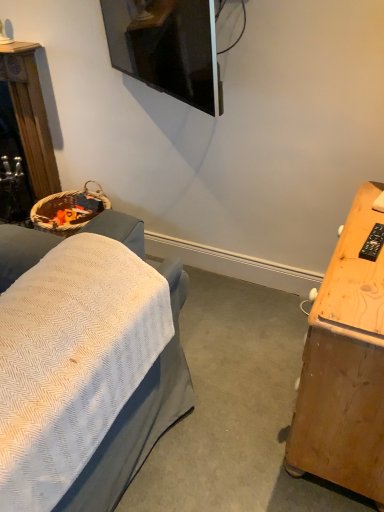
In order to click on woven basket at left in this screenshot , I will do `click(30, 115)`.

This screenshot has width=384, height=512. What do you see at coordinates (30, 115) in the screenshot?
I see `woven basket at left` at bounding box center [30, 115].

What do you see at coordinates (346, 362) in the screenshot? Image resolution: width=384 pixels, height=512 pixels. I see `light brown wood desk at right` at bounding box center [346, 362].

Consider the image. In order to face light brown wood desk at right, should I rotate leftwards or rightwards?

Turn right approximately 22.062 degrees to face it.

Find the location of a particular element. light brown wood desk at right is located at coordinates (346, 362).

Measure the distance between light brown wood desk at right and camera.

light brown wood desk at right is 38.52 inches from camera.

Locate an element on the screen. woven basket at left is located at coordinates (30, 115).

Is light brown wood desk at right to the left of woven basket at left from the viewer's perspective?

In fact, light brown wood desk at right is to the right of woven basket at left.

Does light brown wood desk at right lie behind woven basket at left?

No, the depth of light brown wood desk at right is less than that of woven basket at left.

Is point (303, 472) positioned before point (32, 104)?

Yes, it is.

From the image's perspective, between light brown wood desk at right and woven basket at left, who is located below?

light brown wood desk at right.

From a real-world perspective, is light brown wood desk at right physically above woven basket at left?

No, from a real-world perspective, light brown wood desk at right is not over woven basket at left

Considering the sizes of objects light brown wood desk at right and woven basket at left in the image provided, who is thinner, light brown wood desk at right or woven basket at left?

With smaller width is woven basket at left.

Between light brown wood desk at right and woven basket at left, which one has more height?

woven basket at left.

Considering the sizes of objects light brown wood desk at right and woven basket at left in the image provided, who is bigger, light brown wood desk at right or woven basket at left?

With larger size is light brown wood desk at right.

Is light brown wood desk at right not inside woven basket at left?

light brown wood desk at right is positioned outside woven basket at left.

Is the surface of light brown wood desk at right in direct contact with woven basket at left?

No, light brown wood desk at right is not with woven basket at left.

Is light brown wood desk at right facing towards woven basket at left?

Yes, light brown wood desk at right is aimed at woven basket at left.

How different are the orientations of light brown wood desk at right and woven basket at left in degrees?

The facing directions of light brown wood desk at right and woven basket at left are 90 degrees apart.

Where is `furniture that appears above the light brown wood desk at right (from a real-world perspective)`? The image size is (384, 512). furniture that appears above the light brown wood desk at right (from a real-world perspective) is located at coordinates (30, 115).

Does woven basket at left appear on the left side of light brown wood desk at right?

Yes, woven basket at left is to the left of light brown wood desk at right.

Is the depth of woven basket at left less than that of light brown wood desk at right?

No, it is not.

Which is in front, point (20, 123) or point (297, 442)?

The point (297, 442) is more forward.

From the image's perspective, is woven basket at left located above light brown wood desk at right?

Yes, from the image's perspective, woven basket at left is over light brown wood desk at right.

From a real-world perspective, relative to light brown wood desk at right, is woven basket at left vertically above or below?

woven basket at left is situated higher than light brown wood desk at right in the real world.

Based on the photo, between woven basket at left and light brown wood desk at right, which one has smaller width?

woven basket at left.

From the picture: Considering the relative sizes of woven basket at left and light brown wood desk at right in the image provided, is woven basket at left taller than light brown wood desk at right?

Yes.

Which of these two, woven basket at left or light brown wood desk at right, is bigger?

Bigger between the two is light brown wood desk at right.

Is woven basket at left completely or partially outside of light brown wood desk at right?

That's correct, woven basket at left is outside of light brown wood desk at right.

Are woven basket at left and light brown wood desk at right far apart?

woven basket at left is far away from light brown wood desk at right.

Is woven basket at left oriented towards light brown wood desk at right?

No.

How distant is woven basket at left from light brown wood desk at right?

They are 6.40 feet apart.

Where is `desk that appears below the woven basket at left (from the image's perspective)`? This screenshot has width=384, height=512. desk that appears below the woven basket at left (from the image's perspective) is located at coordinates (346, 362).

Locate an element on the screen. This screenshot has width=384, height=512. desk beneath the woven basket at left (from a real-world perspective) is located at coordinates (346, 362).

This screenshot has height=512, width=384. There is a light brown wood desk at right. Find the location of `furniture above it (from a real-world perspective)`. furniture above it (from a real-world perspective) is located at coordinates (30, 115).